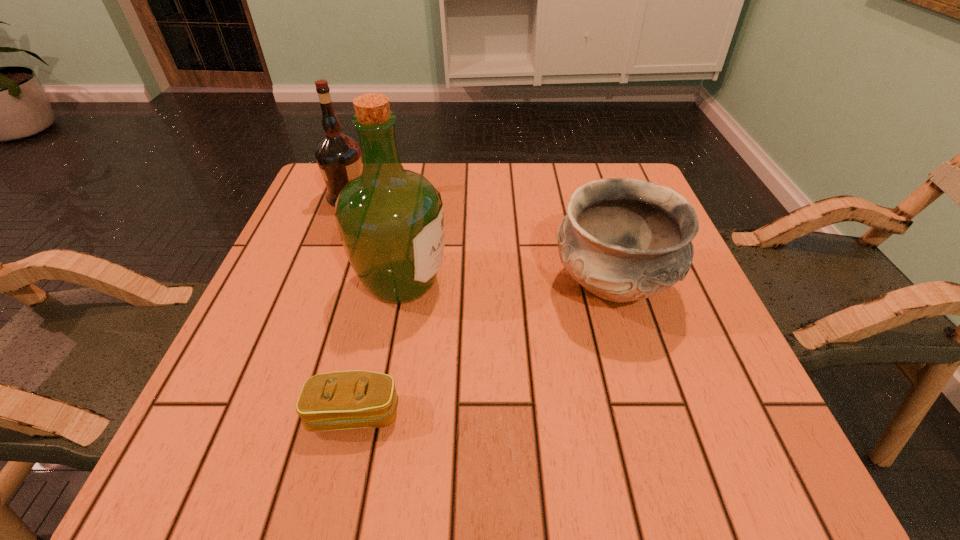
Find the location of a particular element. the nearer liquor is located at coordinates (391, 223).

You are a GUI agent. You are given a task and a screenshot of the screen. Output one action in this format:
    pyautogui.click(x=<x>, y=<y>)
    Task: Click on the tallest object
    This screenshot has width=960, height=540.
    Given the screenshot: What is the action you would take?
    pyautogui.click(x=391, y=223)

In order to click on the farthest object in this screenshot , I will do `click(338, 156)`.

You are a GUI agent. You are given a task and a screenshot of the screen. Output one action in this format:
    pyautogui.click(x=<x>, y=<y>)
    Task: Click on the farther liquor
    Image resolution: width=960 pixels, height=540 pixels.
    Given the screenshot: What is the action you would take?
    pyautogui.click(x=338, y=156)

The height and width of the screenshot is (540, 960). Find the location of `pottery`. pottery is located at coordinates (623, 240).

Find the location of a particular element. The image size is (960, 540). the rightmost object is located at coordinates (623, 240).

This screenshot has height=540, width=960. Find the location of `clutch bag`. clutch bag is located at coordinates (354, 399).

The image size is (960, 540). Find the location of `the shortest object`. the shortest object is located at coordinates (354, 399).

Where is `vacant area situated on the front-facing side of the right liquor`? The height and width of the screenshot is (540, 960). vacant area situated on the front-facing side of the right liquor is located at coordinates (473, 282).

Image resolution: width=960 pixels, height=540 pixels. In order to click on vacant region located on the surface of the farthest object in this screenshot , I will do `click(393, 197)`.